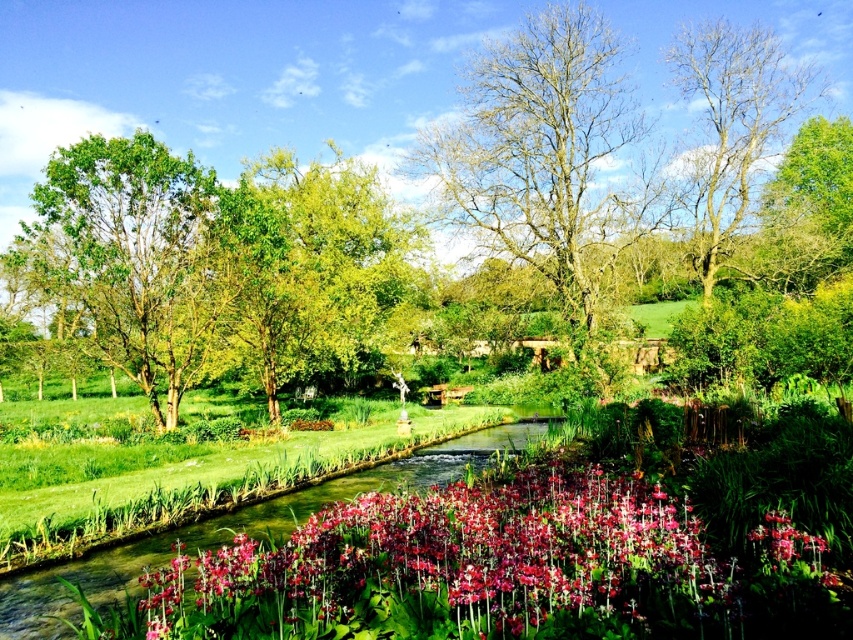
Question: Is the position of clear water at center more distant than that of bare wood tree at upper right?

Choices:
 (A) no
 (B) yes

Answer: (A)

Question: Which of the following is the closest to the observer?

Choices:
 (A) pink glossy flowers at center
 (B) bare wood tree at center
 (C) green leafy tree at left

Answer: (A)

Question: Does bare wood tree at upper right have a smaller size compared to pink glossy flower at center?

Choices:
 (A) yes
 (B) no

Answer: (B)

Question: Is bare wood tree at center further to camera compared to clear water at center?

Choices:
 (A) yes
 (B) no

Answer: (A)

Question: Estimate the real-world distances between objects in this image. Which object is closer to the pink glossy flowers at center?

Choices:
 (A) pink glossy flower at center
 (B) green leafy tree at left
 (C) clear water at center
 (D) bare wood tree at upper right

Answer: (A)

Question: Among these objects, which one is farthest from the camera?

Choices:
 (A) pink glossy flower at center
 (B) pink glossy flowers at center
 (C) green leafy tree at left
 (D) bare wood tree at center

Answer: (D)